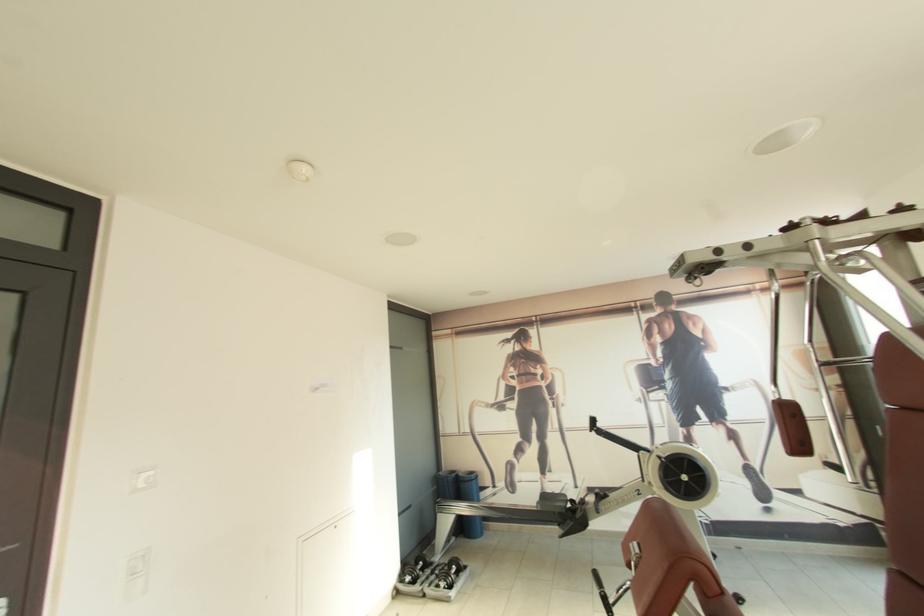
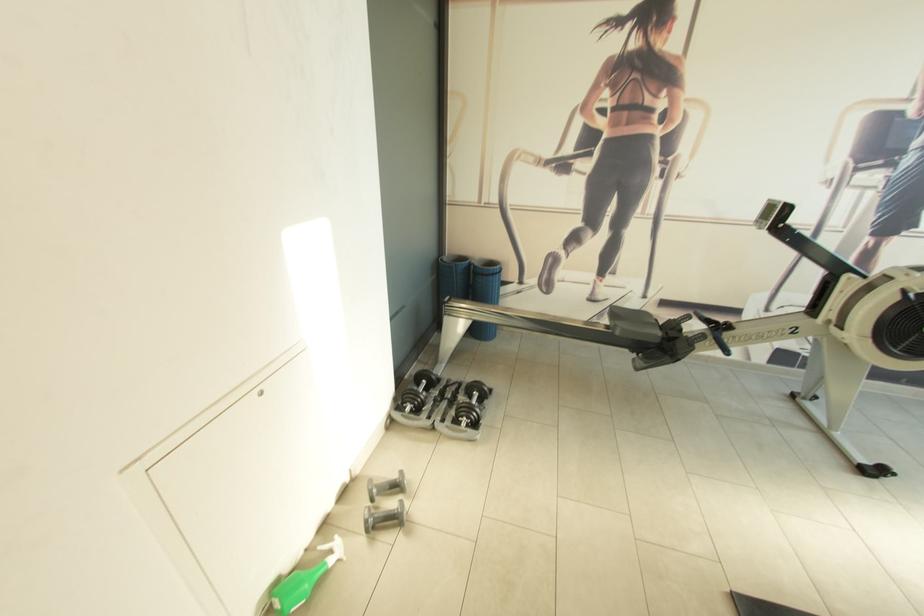
Find the pixel in the second image that matches (x=445, y=475) in the first image.

(451, 261)